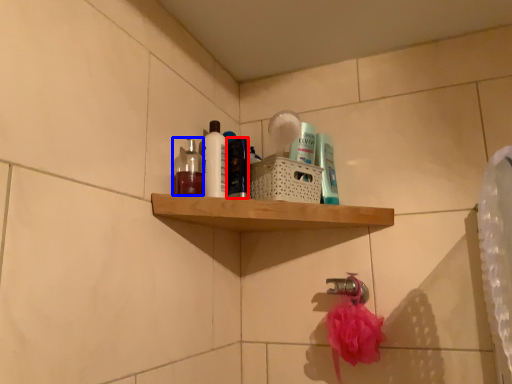
Question: Which object appears farthest to the camera in this image, toiletry (highlighted by a red box) or mouthwash (highlighted by a blue box)?

Choices:
 (A) toiletry
 (B) mouthwash

Answer: (A)